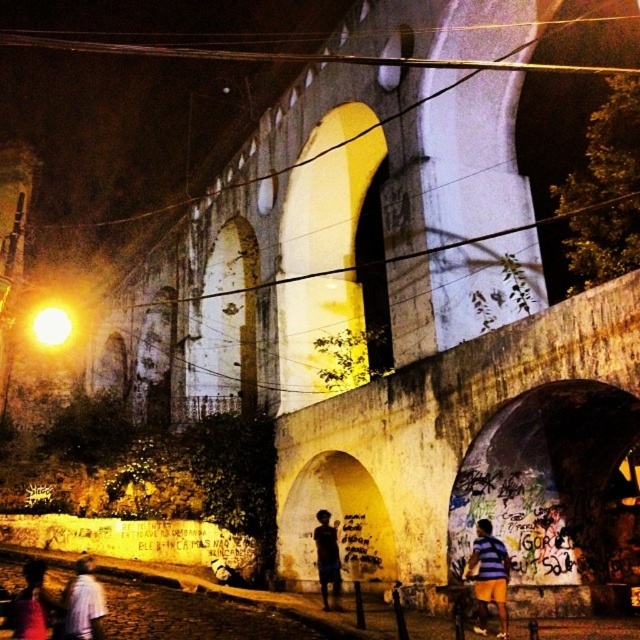
You are a photographer trying to capture the two people in the scene. The white cotton shirt at lower left and the matte pink shirt at lower left are both in your frame. If you want to ensure both shirts are visible in your photo, which shirt should you focus on to avoid blurring due to their sizes?

The white cotton shirt at lower left has a lesser width compared to the matte pink shirt at lower left. Therefore, focusing on the matte pink shirt at lower left would be better to ensure both are visible without blurring, as it is wider and might require more attention in the frame.

You are standing at the point closer to the camera between the two points, point (561,477) and point (465,564). Which point are you standing at?

You are standing at point (561,477) because it is further to the camera than point (465,564).

You are standing at the center of the aqueduct structure. Looking down towards the lower left corner of the image, can you see the white cotton shirt at lower left? Please explain based on your position and the location of the shirt.

Yes, the white cotton shirt at lower left is located at point 2D coordinates of (x=83, y=604), which would be visible from the center of the aqueduct structure as it is positioned towards the lower left corner of the image.